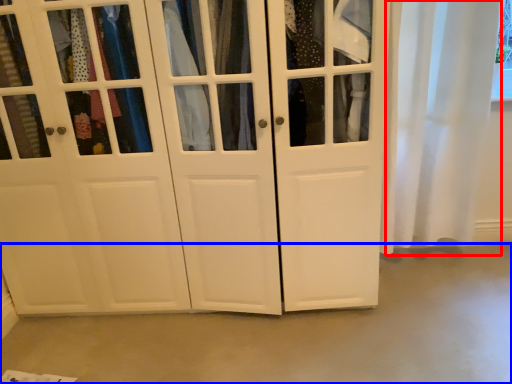
Question: Which object appears closest to the camera in this image, curtain (highlighted by a red box) or concrete (highlighted by a blue box)?

Choices:
 (A) curtain
 (B) concrete

Answer: (B)